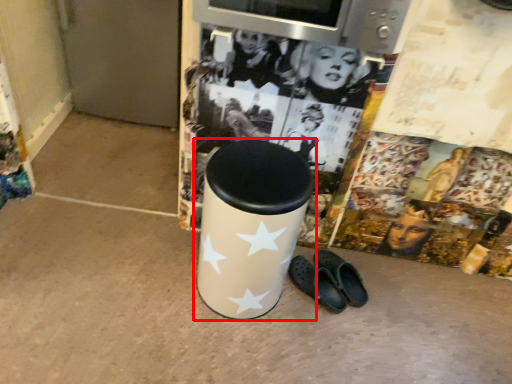
Question: Considering the relative positions of waste container (annotated by the red box) and footwear in the image provided, where is waste container (annotated by the red box) located with respect to the staircase?

Choices:
 (A) left
 (B) right

Answer: (A)